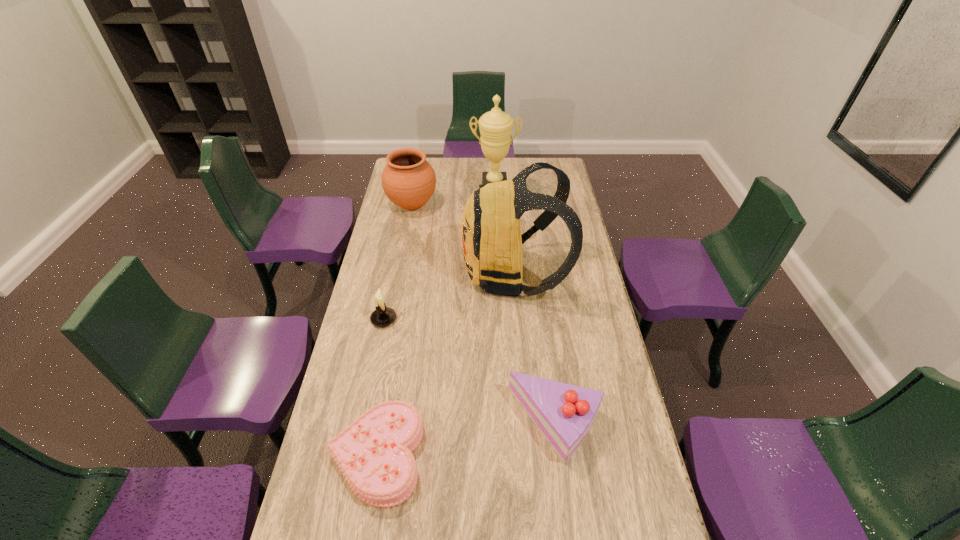
You are a GUI agent. You are given a task and a screenshot of the screen. Output one action in this format:
    pyautogui.click(x=<x>, y=<y>)
    Task: Click on the vacant space situated 0.280m on the front-facing side of the fifth shortest object
    
    Given the screenshot: What is the action you would take?
    pyautogui.click(x=393, y=273)

Where is `vacant space located on the front-facing side of the fifth shortest object`? vacant space located on the front-facing side of the fifth shortest object is located at coordinates (408, 273).

Identify the location of free location located 0.280m on the front of the fourth shortest object. (401, 261).

Identify the location of vacant area situated 0.120m on the front of the candle holder. (375, 357).

Where is `vacant space positioned on the left of the right cake`? vacant space positioned on the left of the right cake is located at coordinates (491, 424).

At what (x,y) coordinates should I click in order to perform the action: click on vacant space located 0.290m on the right of the shortest object. Please return your answer as a coordinate pair (x, y). The height and width of the screenshot is (540, 960). Looking at the image, I should click on tap(525, 455).

Find the location of a particular element. This screenshot has height=540, width=960. pottery located at the left edge is located at coordinates (408, 180).

Where is `candle holder at the left edge`? candle holder at the left edge is located at coordinates (382, 316).

At what (x,y) coordinates should I click in order to perform the action: click on cake at the left edge. Please return your answer as a coordinate pair (x, y). The height and width of the screenshot is (540, 960). Looking at the image, I should click on (374, 454).

Identify the location of backpack that is at the right edge. (492, 241).